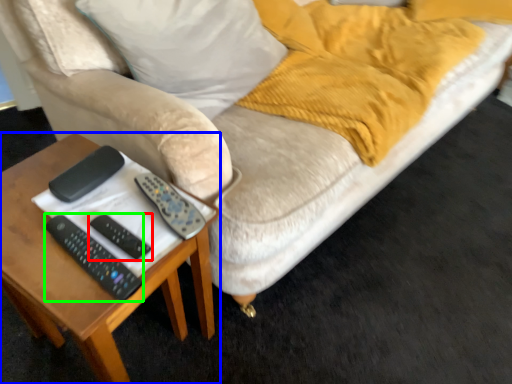
Question: Which object is the closest to the remote (highlighted by a red box)? Choose among these: table (highlighted by a blue box) or remote (highlighted by a green box).

Choices:
 (A) table
 (B) remote

Answer: (B)